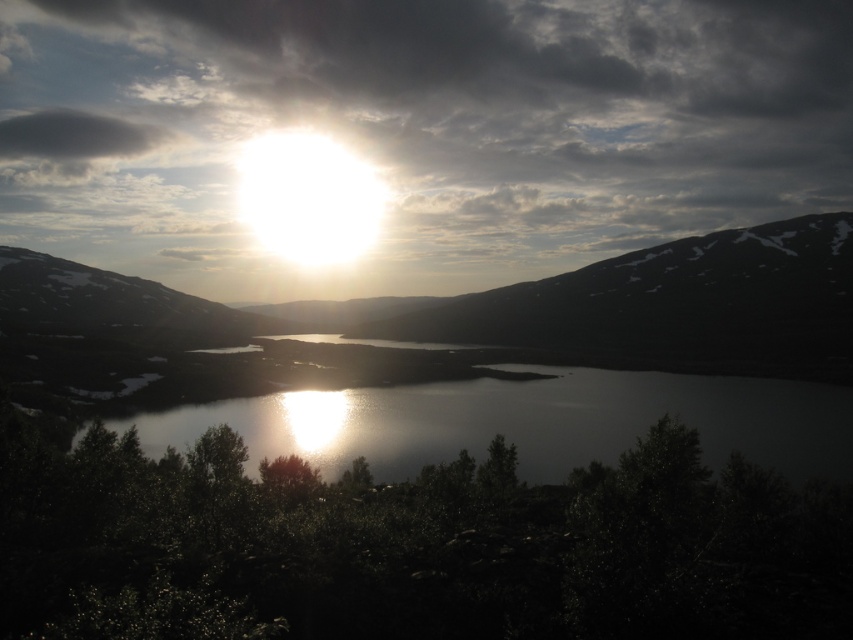
You are a hiker who wants to take a photo of the dark gray rocky mountain at center from the best possible angle. Given the coordinates of the mountain in the image, where should you position yourself relative to the mountain to capture its full height in the frame?

To capture the full height of the dark gray rocky mountain at center, position yourself directly in front of it along the same horizontal plane, ensuring the camera is aligned with the mountain at its base. The coordinates provided indicate its central position, so centering the frame on the mountain at point (x=672, y=305) will optimize the composition for its vertical dimension.

You are an artist planning to paint the landscape. You want to emphasize the dark gray rocky mountain at center and the glistening reflective water at center. Which object should you paint first if you want to follow the rule of painting larger objects before smaller ones?

The dark gray rocky mountain at center is larger in size than the glistening reflective water at center, so you should paint the dark gray rocky mountain at center first.